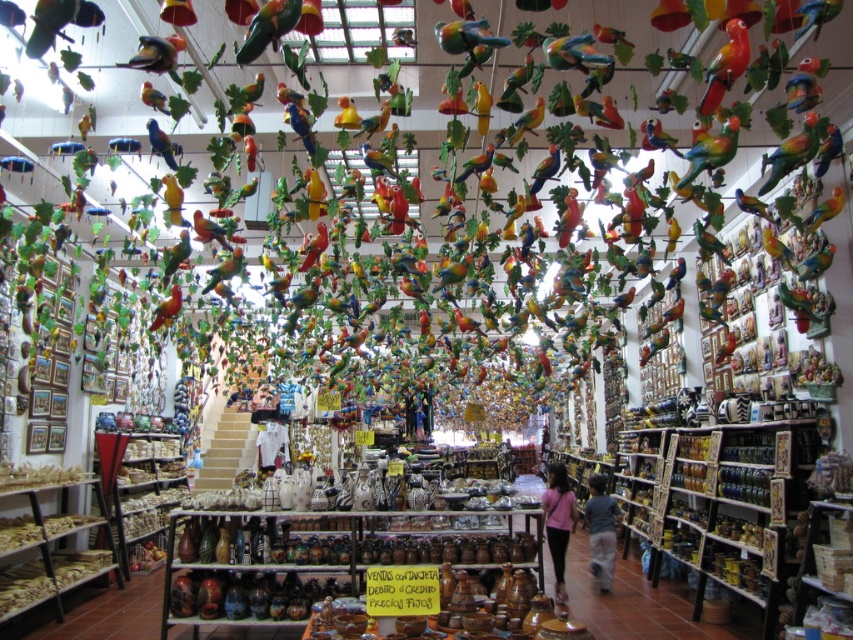
You are a photographer standing at the entrance of the souvenir shop. You want to take a clear photo of the shiny multicolored parrot at upper right without any obstructions. Considering the parrot is 9.94 feet away from your camera, is this distance within a typical focus range for most consumer cameras?

Yes, the shiny multicolored parrot at upper right is 9.94 feet away from the camera, which is well within the typical focus range of most consumer cameras, allowing for a clear photo without obstructions.

You are a customer in the souvenir shop holding a rectangular box that is 10 cm thick. You want to place it on a shelf between the shiny multicolored parrot at upper right and the matte blue parrot at upper center. Can the box fit between them based on their thickness?

The shiny multicolored parrot at upper right is thinner than the matte blue parrot at upper center. Since the box is 10 cm thick, we need to know the combined thickness of both parrots to determine if there is enough space. However, the provided information only states their relative thickness, not their exact measurements. Therefore, it is unclear if the box will fit without additional details.

Looking at this image, you are a customer in the souvenir shop and want to take a photo of both the shiny multicolored parrot at upper right and the matte blue parrot at upper center. Which parrot should you aim your camera at first if you want to capture both in the same frame without moving your camera?

You should aim your camera at the shiny multicolored parrot at upper right first because it is above the matte blue parrot at upper center, so by focusing on the higher one, you can include both in the frame without moving the camera.